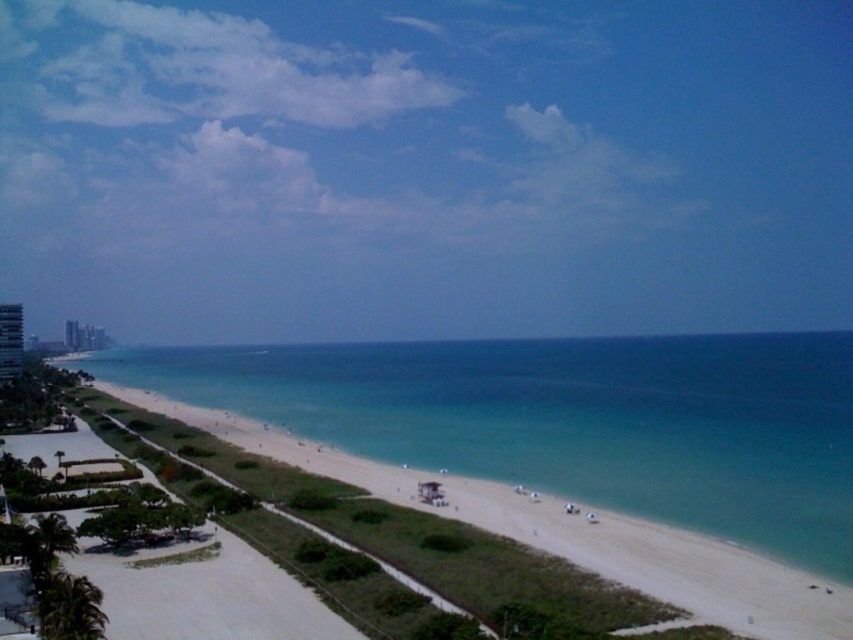
You are standing on the beach and want to take a photo of the clear blue water at center. Where should you position yourself to capture it in the frame?

To capture the clear blue water at center in your photo, position yourself so that the water is centered at the coordinates point (x=570, y=420).

You are standing on the beach and want to take a photo of the white concrete building at left without including the clear blue water at center in the frame. Which direction should you move to ensure the building is visible but the water is out of the shot?

Move to the left of the white concrete building at left so that the building blocks the view of the clear blue water at center, which is to the right of the building.